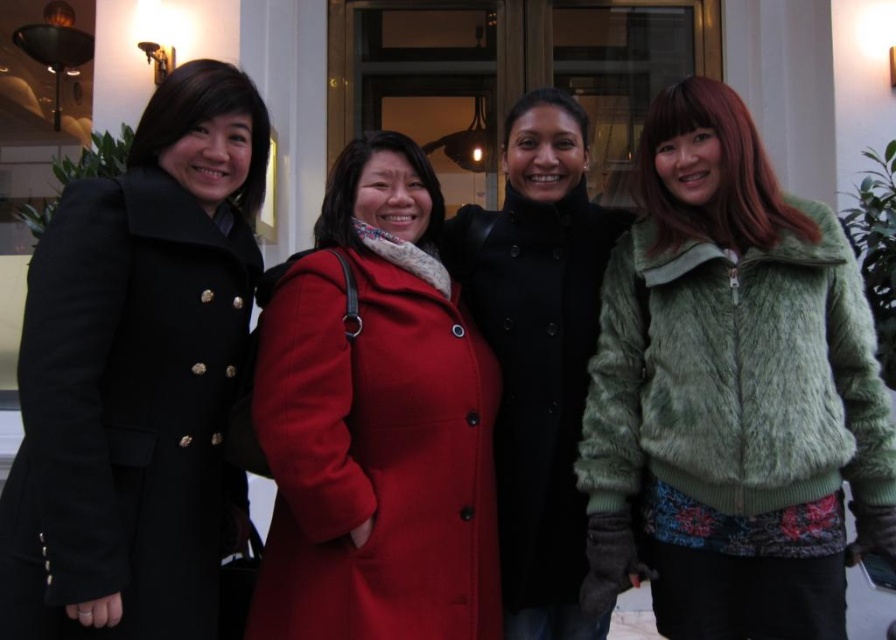
Question: Which object appears closest to the camera in this image?

Choices:
 (A) velvet black coat at center
 (B) matte woolen coat at center
 (C) green furry jacket at right

Answer: (B)

Question: Does green furry jacket at right appear on the left side of matte woolen coat at center?

Choices:
 (A) yes
 (B) no

Answer: (B)

Question: Among these objects, which one is farthest from the camera?

Choices:
 (A) matte woolen coat at center
 (B) green furry jacket at right
 (C) velvet black coat at center

Answer: (C)

Question: Can you confirm if green furry jacket at right is positioned to the left of velvet black coat at center?

Choices:
 (A) yes
 (B) no

Answer: (B)

Question: Does green furry jacket at right appear over matte black coat at left?

Choices:
 (A) no
 (B) yes

Answer: (A)

Question: Which of these objects is positioned farthest from the matte woolen coat at center?

Choices:
 (A) matte black coat at left
 (B) green furry jacket at right
 (C) velvet black coat at center

Answer: (B)